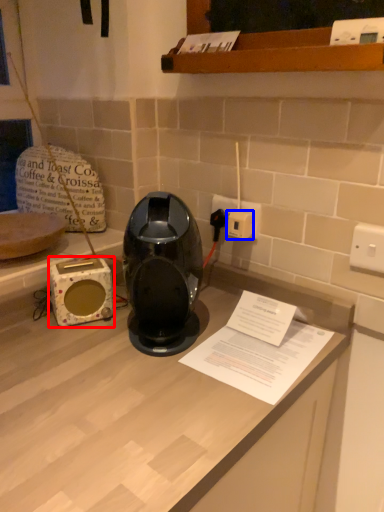
Question: Which of the following is the farthest to the observer, appliance (highlighted by a red box) or socket (highlighted by a blue box)?

Choices:
 (A) appliance
 (B) socket

Answer: (B)